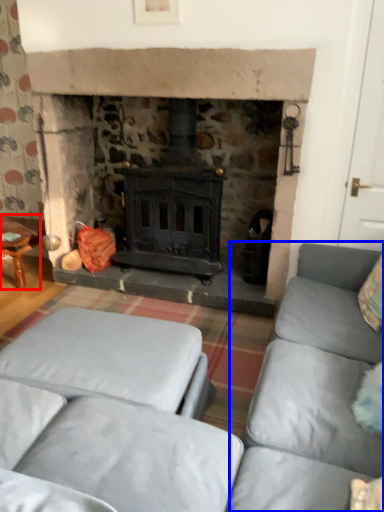
Question: Which object appears farthest to the camera in this image, table (highlighted by a red box) or couch (highlighted by a blue box)?

Choices:
 (A) table
 (B) couch

Answer: (A)